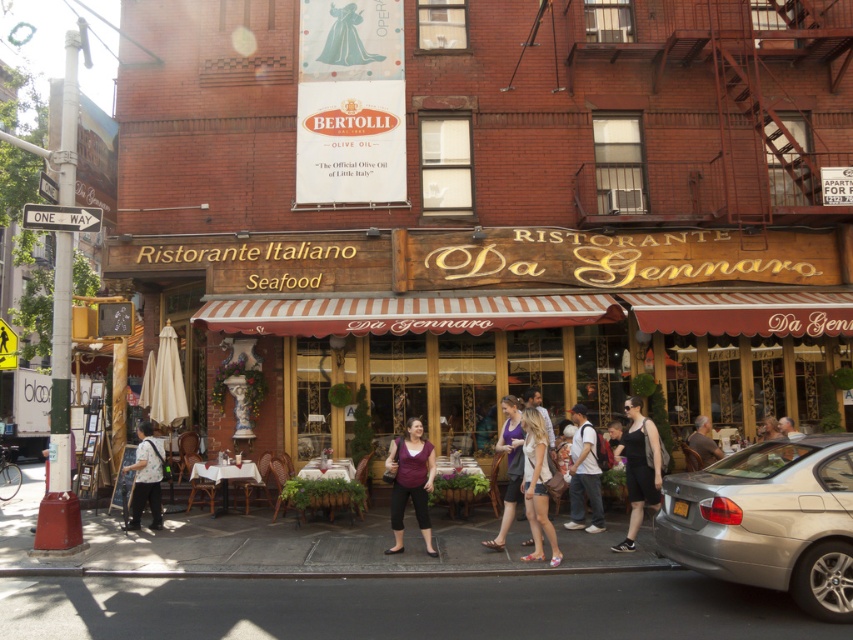
You are standing in the street scene in front of the restaurant. You see two points marked on the image. The first point is at coordinates point (149, 451) and the second point is at point (511, 508). Which point is closer to you?

Point (149, 451) is further to the camera than point (511, 508). Therefore, the second point at (511, 508) is closer to you.

Looking at this image, you are a delivery person standing at the entrance of Ristorante Italiano Seafood. You need to place a package on the silver metallic sedan at lower right. However, there is a purple fabric dress at center in the way. Can you reach the sedan without moving the dress?

The silver metallic sedan at lower right and purple fabric dress at center are 9.39 feet apart. Since the distance between them is sufficient, you can reach the sedan without moving the dress.

You are standing in the street scene in front of the restaurant and need to determine which of the two points, point (428,49) or point (534,451), is closer to you. Can you figure out which one is nearer?

Point (428,49) is closer to you because it is further to the viewer than point (534,451).